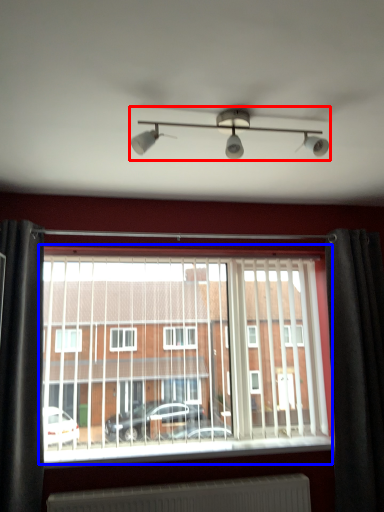
Question: Which of the following is the closest to the observer, light fixture (highlighted by a red box) or window (highlighted by a blue box)?

Choices:
 (A) light fixture
 (B) window

Answer: (A)